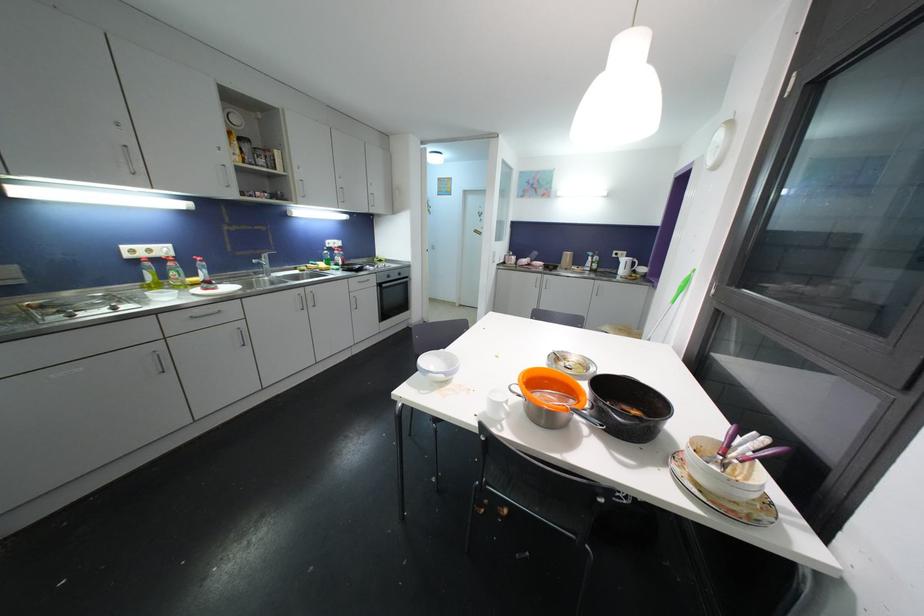
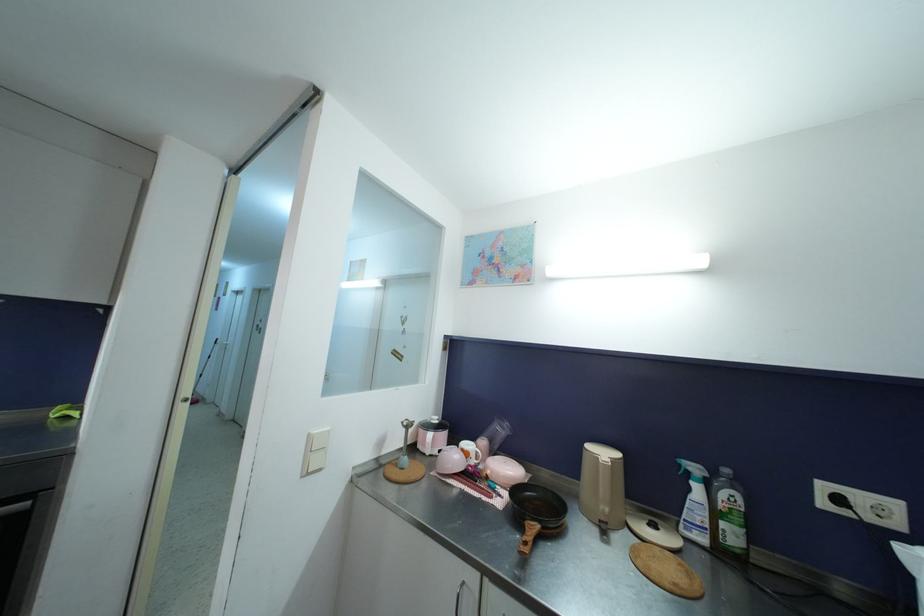
The images are taken continuously from a first-person perspective. In which direction are you moving?

The cameraman walked toward right, forward.